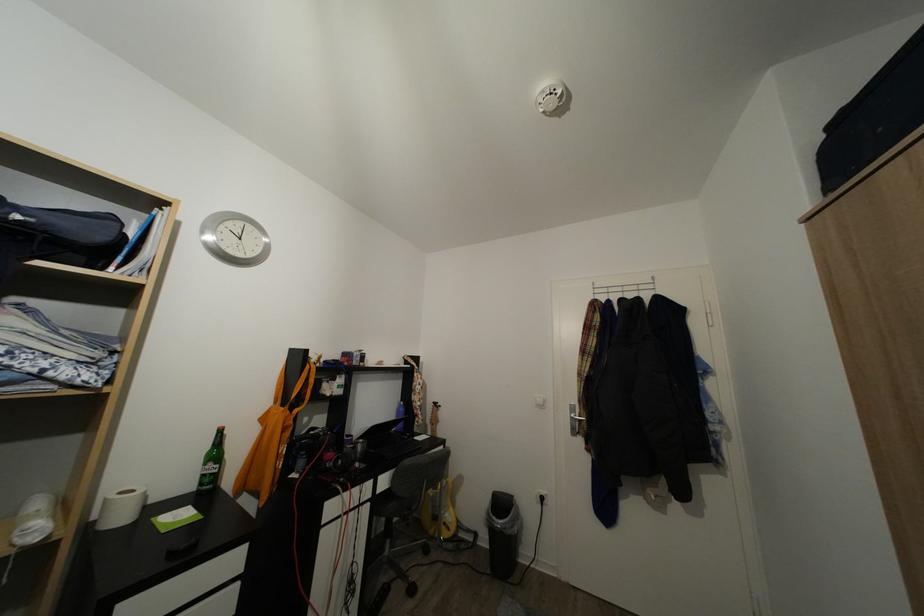
Find where to pull the silver door handle. Please return your answer as a coordinate pair (x, y).

(576, 418)